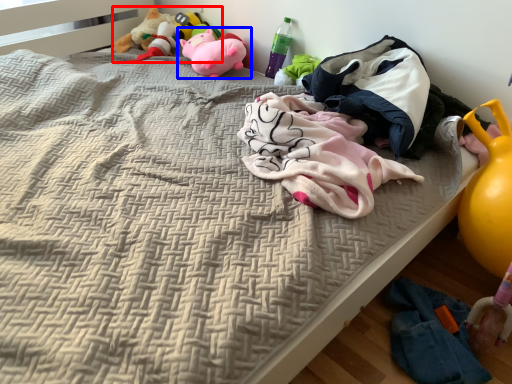
Question: Which of the following is the closest to the observer, toy (highlighted by a red box) or toy (highlighted by a blue box)?

Choices:
 (A) toy
 (B) toy

Answer: (B)